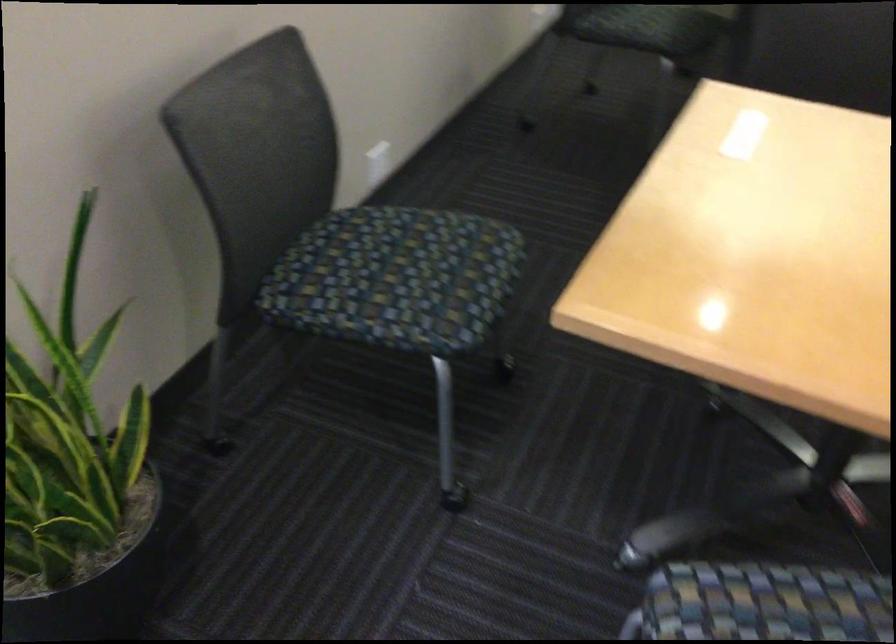
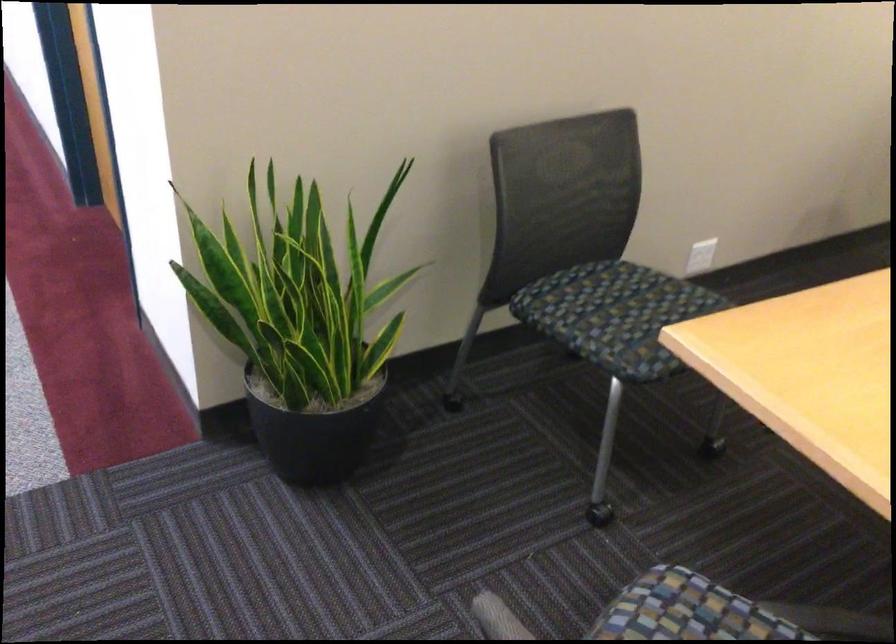
Question: The camera is either moving clockwise (left) or counter-clockwise (right) around the object. The first image is from the beginning of the video and the second image is from the end. Is the camera moving left or right when shooting the video?

Choices:
 (A) Left
 (B) Right

Answer: (B)